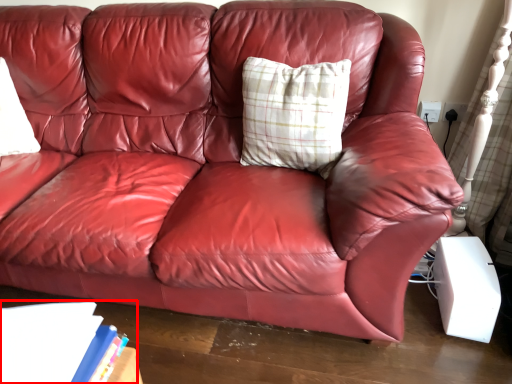
Question: From the image's perspective, what is the correct spatial relationship of book (annotated by the red box) in relation to pillow?

Choices:
 (A) above
 (B) below

Answer: (B)